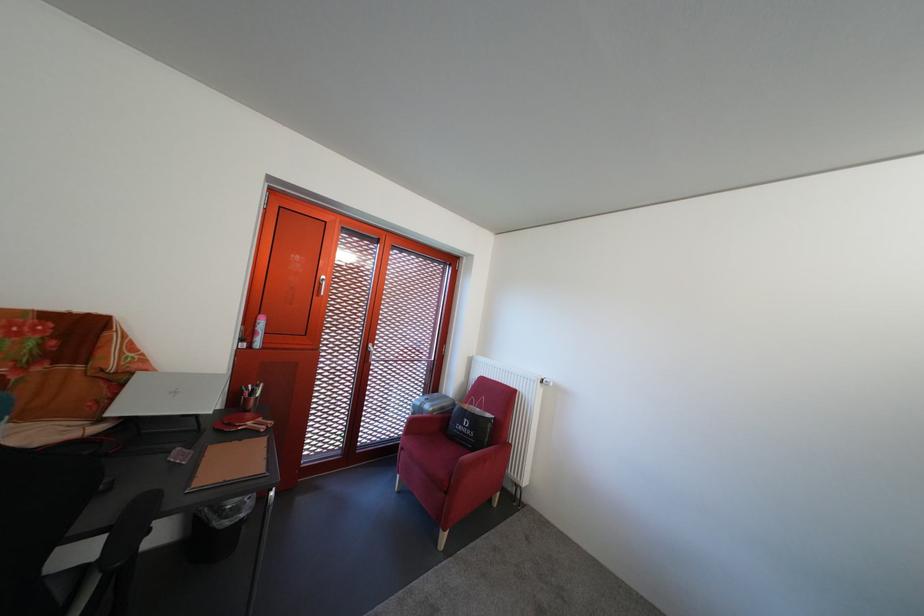
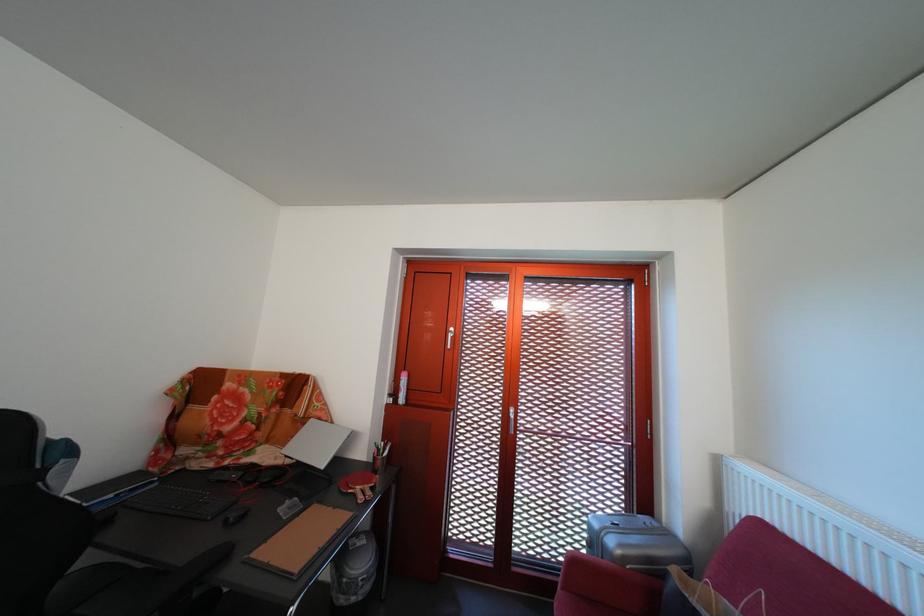
Question: The camera is either moving clockwise (left) or counter-clockwise (right) around the object. The first image is from the beginning of the video and the second image is from the end. Is the camera moving left or right when shooting the video?

Choices:
 (A) Left
 (B) Right

Answer: (B)